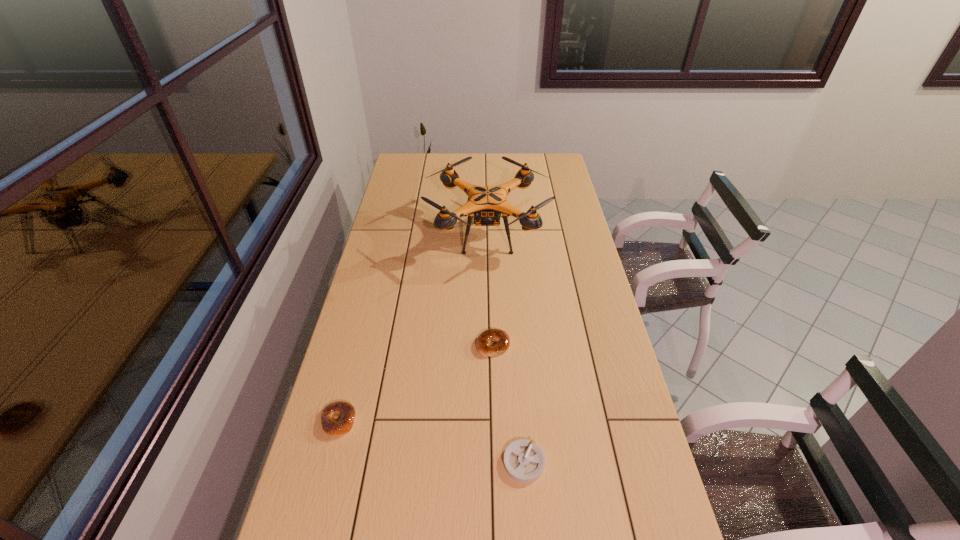
Where is `free space that satisfies the following two spatial constraints: 1. on the back side of the third nearest object; 2. on the camera mount of the tallest object`? free space that satisfies the following two spatial constraints: 1. on the back side of the third nearest object; 2. on the camera mount of the tallest object is located at coordinates (491, 233).

Find the location of a particular element. This screenshot has height=540, width=960. vacant space that satisfies the following two spatial constraints: 1. on the camera mount of the ashtray; 2. on the left side of the drone is located at coordinates (492, 462).